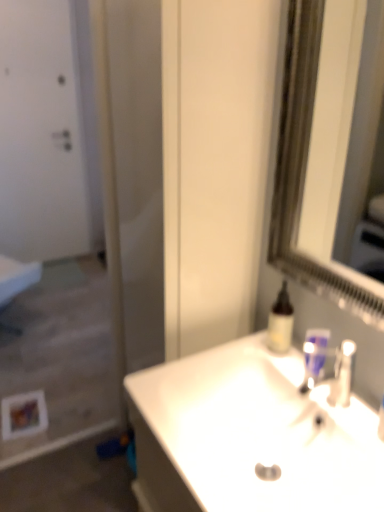
Identify the location of vacant space to the left of blue plastic mouthwash at sink, the first mouthwash viewed from the right. (266, 362).